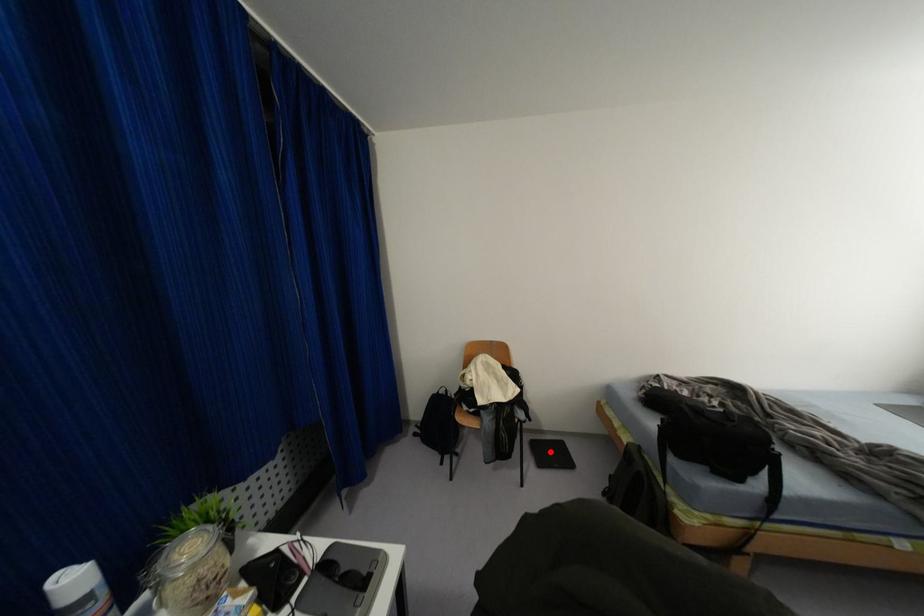
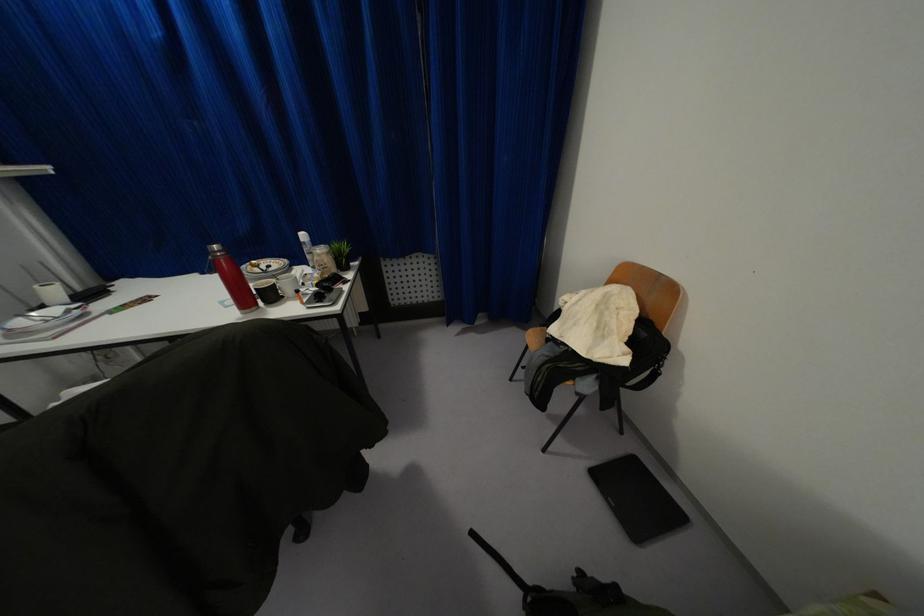
Locate, in the second image, the point that corresponds to the highlighted location in the first image.

(636, 493)